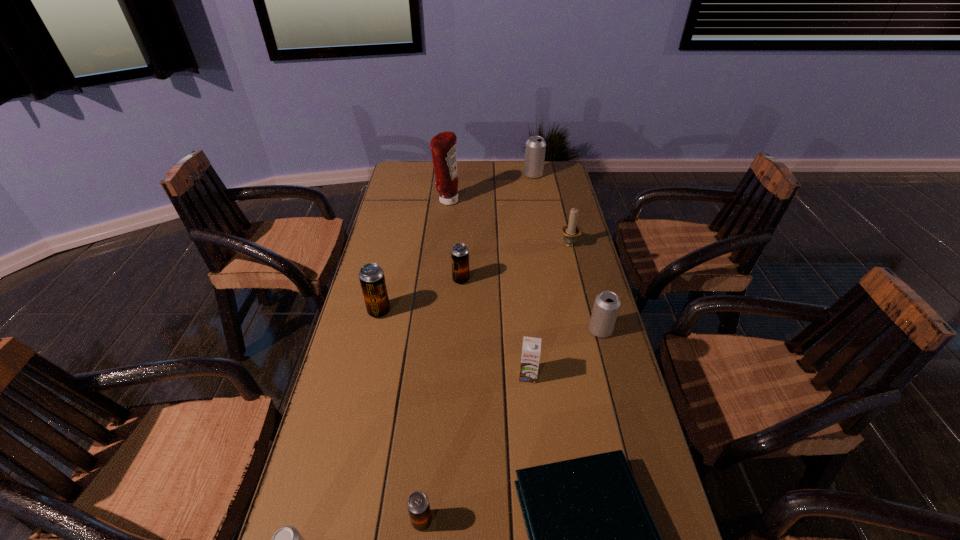
Choose which object is the ninth nearest neighbor to the fourth beer can from left to right. Please provide its 2D coordinates. Your answer should be formatted as a tuple, i.e. [(x, y)], where the tuple contains the x and y coordinates of a point satisfying the conditions above.

[(287, 539)]

Find the location of a particular element. object that is the sixth closest one to the brown chocolate milk is located at coordinates (571, 231).

Locate an element on the screen. beer can object that ranks as the closest to the leftmost white beer can is located at coordinates (418, 505).

Choose which beer can is the nearest neighbor to the second white beer can from left to right. Please provide its 2D coordinates. Your answer should be formatted as a tuple, i.e. [(x, y)], where the tuple contains the x and y coordinates of a point satisfying the conditions above.

[(459, 253)]

Find the location of a particular element. This screenshot has width=960, height=540. white beer can that is the second nearest to the biggest black beer can is located at coordinates click(x=287, y=539).

Where is `white beer can that stands as the second closest to the condiment`? Image resolution: width=960 pixels, height=540 pixels. white beer can that stands as the second closest to the condiment is located at coordinates (606, 306).

Choose which black beer can is the second nearest neighbor to the candle_holder. Please provide its 2D coordinates. Your answer should be formatted as a tuple, i.e. [(x, y)], where the tuple contains the x and y coordinates of a point satisfying the conditions above.

[(371, 275)]

Locate an element on the screen. Image resolution: width=960 pixels, height=540 pixels. black beer can that stands as the second closest to the rightmost white beer can is located at coordinates (371, 275).